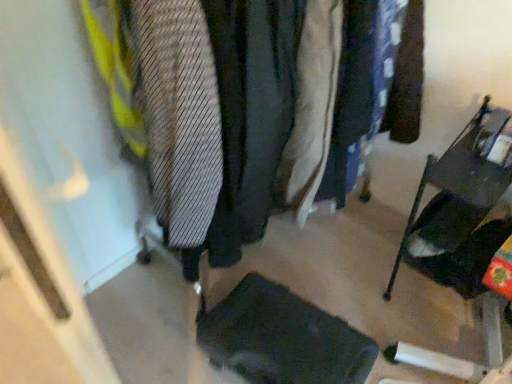
The width and height of the screenshot is (512, 384). What do you see at coordinates (282, 338) in the screenshot?
I see `black fabric footrest at lower center` at bounding box center [282, 338].

Looking at this image, what is the approximate width of striped fabric tie at left?

23.38 inches.

The image size is (512, 384). I want to click on light beige fabric coat at center, so click(311, 108).

In terms of height, does black fabric footrest at lower center look taller or shorter compared to striped fabric tie at left?

In the image, black fabric footrest at lower center appears to be shorter than striped fabric tie at left.

In the image, is black fabric footrest at lower center positioned in front of or behind striped fabric tie at left?

Visually, black fabric footrest at lower center is located behind striped fabric tie at left.

Are black fabric footrest at lower center and striped fabric tie at left far apart?

They are positioned close to each other.

Is black fabric footrest at lower center to the right of striped fabric tie at left from the viewer's perspective?

Correct, you'll find black fabric footrest at lower center to the right of striped fabric tie at left.

Is striped fabric tie at left at the left side of metallic dark gray folding chair at right?

Yes, striped fabric tie at left is to the left of metallic dark gray folding chair at right.

Would you say striped fabric tie at left is outside metallic dark gray folding chair at right?

Yes.

Which of these two, striped fabric tie at left or metallic dark gray folding chair at right, is thinner?

metallic dark gray folding chair at right is thinner.

Considering the points (170, 141) and (451, 224), which point is in front, point (170, 141) or point (451, 224)?

The point (170, 141) is closer to the camera.

Does metallic dark gray folding chair at right lie in front of light beige fabric coat at center?

No, it is behind light beige fabric coat at center.

Is metallic dark gray folding chair at right taller than light beige fabric coat at center?

Incorrect, the height of metallic dark gray folding chair at right is not larger of that of light beige fabric coat at center.

The width and height of the screenshot is (512, 384). What are the coordinates of `furniture below the light beige fabric coat at center (from the image's perspective)` in the screenshot? It's located at (464, 234).

Is metallic dark gray folding chair at right turned away from light beige fabric coat at center?

metallic dark gray folding chair at right does not have its back to light beige fabric coat at center.

Could you tell me if black fabric footrest at lower center is turned towards metallic dark gray folding chair at right?

No.

Which of these two, black fabric footrest at lower center or metallic dark gray folding chair at right, stands shorter?

black fabric footrest at lower center.

Does black fabric footrest at lower center appear on the right side of metallic dark gray folding chair at right?

Incorrect, black fabric footrest at lower center is not on the right side of metallic dark gray folding chair at right.

Which is behind, black fabric footrest at lower center or metallic dark gray folding chair at right?

black fabric footrest at lower center.

Considering the relative sizes of striped fabric tie at left and black fabric footrest at lower center in the image provided, is striped fabric tie at left shorter than black fabric footrest at lower center?

In fact, striped fabric tie at left may be taller than black fabric footrest at lower center.

Between striped fabric tie at left and black fabric footrest at lower center, which one is positioned in front?

striped fabric tie at left is more forward.

Based on the photo, which is closer to the camera, (146, 114) or (362, 354)?

Point (146, 114) appears to be closer to the viewer than point (362, 354).

Which object is positioned more to the right, light beige fabric coat at center or black fabric footrest at lower center?

From the viewer's perspective, light beige fabric coat at center appears more on the right side.

In the scene shown: Is light beige fabric coat at center in contact with black fabric footrest at lower center?

No.

In terms of height, does light beige fabric coat at center look taller or shorter compared to black fabric footrest at lower center?

Clearly, light beige fabric coat at center is taller compared to black fabric footrest at lower center.

Locate an element on the screen. tie above the light beige fabric coat at center (from the image's perspective) is located at coordinates (179, 116).

Is light beige fabric coat at center at the left side of striped fabric tie at left?

No, light beige fabric coat at center is not to the left of striped fabric tie at left.

Is light beige fabric coat at center shorter than striped fabric tie at left?

No, light beige fabric coat at center is not shorter than striped fabric tie at left.

You are a GUI agent. You are given a task and a screenshot of the screen. Output one action in this format:
    pyautogui.click(x=<x>, y=<y>)
    Task: Click on the footrest located underneath the striped fabric tie at left (from a real-world perspective)
    
    Given the screenshot: What is the action you would take?
    pyautogui.click(x=282, y=338)

Locate an element on the screen. furniture located behind the striped fabric tie at left is located at coordinates (464, 234).

From the image, which object appears to be nearer to light beige fabric coat at center, metallic dark gray folding chair at right or black fabric footrest at lower center?

Among the two, black fabric footrest at lower center is located nearer to light beige fabric coat at center.

Estimate the real-world distances between objects in this image. Which object is closer to metallic dark gray folding chair at right, light beige fabric coat at center or black fabric footrest at lower center?

The object closer to metallic dark gray folding chair at right is black fabric footrest at lower center.

Considering their positions, is black fabric footrest at lower center positioned further to striped fabric tie at left than metallic dark gray folding chair at right?

Based on the image, metallic dark gray folding chair at right appears to be further to striped fabric tie at left.

When comparing their distances from striped fabric tie at left, does black fabric footrest at lower center or light beige fabric coat at center seem closer?

Based on the image, light beige fabric coat at center appears to be nearer to striped fabric tie at left.

From the image, which object appears to be nearer to striped fabric tie at left, light beige fabric coat at center or black fabric footrest at lower center?

Based on the image, light beige fabric coat at center appears to be nearer to striped fabric tie at left.

Based on the photo, from the image, which object appears to be nearer to light beige fabric coat at center, metallic dark gray folding chair at right or striped fabric tie at left?

The object closer to light beige fabric coat at center is striped fabric tie at left.

From the image, which object appears to be nearer to light beige fabric coat at center, striped fabric tie at left or metallic dark gray folding chair at right?

The object closer to light beige fabric coat at center is striped fabric tie at left.

Considering their positions, is black fabric footrest at lower center positioned further to metallic dark gray folding chair at right than light beige fabric coat at center?

light beige fabric coat at center lies further to metallic dark gray folding chair at right than the other object.

You are a GUI agent. You are given a task and a screenshot of the screen. Output one action in this format:
    pyautogui.click(x=<x>, y=<y>)
    Task: Click on the clothing between black fabric footrest at lower center and metallic dark gray folding chair at right from left to right
    This screenshot has width=512, height=384.
    Given the screenshot: What is the action you would take?
    click(x=311, y=108)

I want to click on footrest between striped fabric tie at left and metallic dark gray folding chair at right from left to right, so click(x=282, y=338).

This screenshot has height=384, width=512. I want to click on clothing between striped fabric tie at left and metallic dark gray folding chair at right, so click(311, 108).

Find the location of a particular element. The height and width of the screenshot is (384, 512). clothing between striped fabric tie at left and black fabric footrest at lower center in the vertical direction is located at coordinates (311, 108).